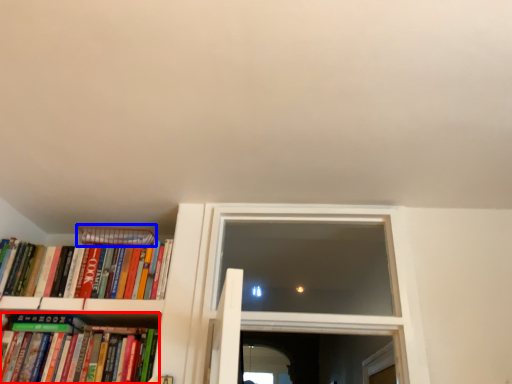
Question: Which object is closer to the camera taking this photo, book (highlighted by a red box) or paperback book (highlighted by a blue box)?

Choices:
 (A) book
 (B) paperback book

Answer: (A)